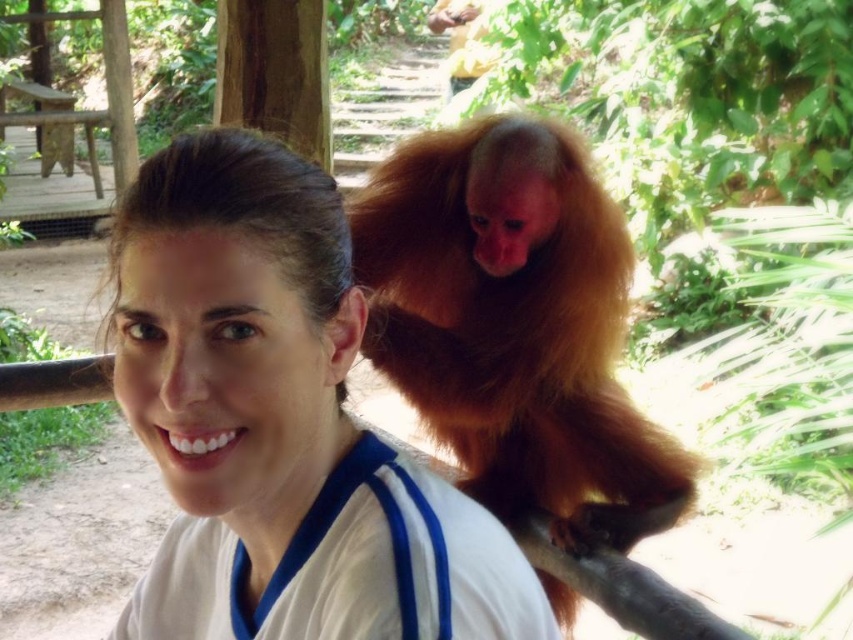
Question: Which object is farther from the camera taking this photo?

Choices:
 (A) white matte shirt at center
 (B) golden fur monkey at upper right

Answer: (B)

Question: Is white matte shirt at center smaller than golden fur monkey at upper right?

Choices:
 (A) yes
 (B) no

Answer: (A)

Question: Among these objects, which one is farthest from the camera?

Choices:
 (A) white matte shirt at center
 (B) golden fur monkey at upper right

Answer: (B)

Question: Does white matte shirt at center appear on the left side of golden fur monkey at upper right?

Choices:
 (A) no
 (B) yes

Answer: (B)

Question: Is white matte shirt at center bigger than golden fur monkey at upper right?

Choices:
 (A) no
 (B) yes

Answer: (A)

Question: Which point is closer to the camera?

Choices:
 (A) (613, 525)
 (B) (270, 212)

Answer: (B)